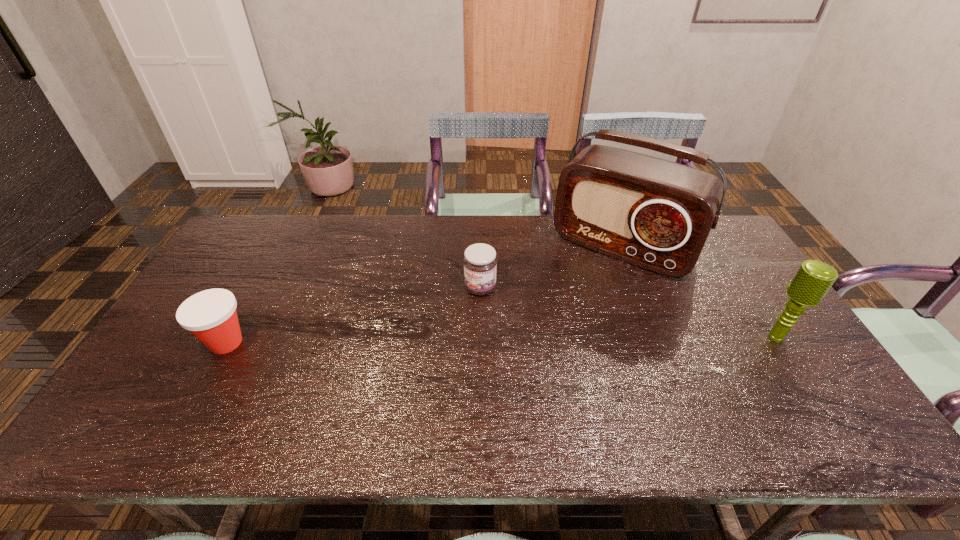
This screenshot has height=540, width=960. I want to click on Dixie cup, so click(x=210, y=315).

At what (x,y) coordinates should I click in order to perform the action: click on the second tallest object. Please return your answer as a coordinate pair (x, y). Image resolution: width=960 pixels, height=540 pixels. Looking at the image, I should click on (813, 279).

Locate an element on the screen. the rightmost object is located at coordinates (813, 279).

Locate an element on the screen. the second object from right to left is located at coordinates (656, 214).

This screenshot has height=540, width=960. I want to click on the tallest object, so click(656, 214).

What are the coordinates of `jam` in the screenshot? It's located at (480, 263).

This screenshot has height=540, width=960. Find the location of `vacant space located 0.220m on the right of the Dixie cup`. vacant space located 0.220m on the right of the Dixie cup is located at coordinates (333, 342).

Where is `vacant space located on the back of the microphone`? vacant space located on the back of the microphone is located at coordinates [741, 282].

At what (x,y) coordinates should I click in order to perform the action: click on vacant space located 0.240m on the front panel of the tallest object. Please return your answer as a coordinate pair (x, y). This screenshot has height=540, width=960. Looking at the image, I should click on (562, 328).

Locate an element on the screen. This screenshot has width=960, height=540. blank space located on the front panel of the tallest object is located at coordinates (564, 323).